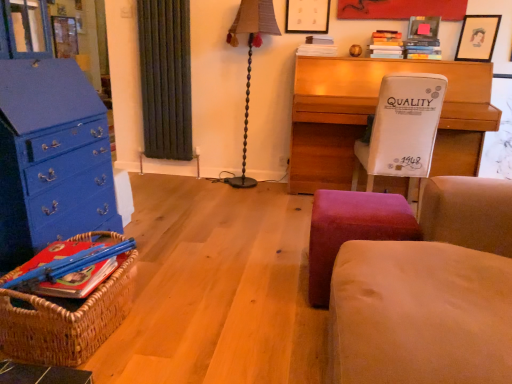
Measure the distance between wooden desk at center and camera.

The distance of wooden desk at center from camera is 9.23 feet.

At what (x,y) coordinates should I click in order to perform the action: click on blue painted wood chest of drawers at left. Please return your answer as a coordinate pair (x, y). Looking at the image, I should click on (51, 158).

Consider the image. In order to face beige fabric rocking chair at right, should I rotate leftwards or rightwards?

Rotate right and turn 26.851 degrees.

Find the location of a particular element. The image size is (512, 384). wooden desk at center is located at coordinates (373, 113).

Considering the positions of objects matte black picture frame at upper right, the third picture frame in the left-to-right sequence, and brown fabric lampshade at center in the image provided, who is in front, matte black picture frame at upper right, the third picture frame in the left-to-right sequence, or brown fabric lampshade at center?

Positioned in front is matte black picture frame at upper right, the third picture frame in the left-to-right sequence.

From a real-world perspective, is matte black picture frame at upper right, the first picture frame positioned from the right, physically located above or below brown fabric lampshade at center?

Clearly, from a real-world perspective, matte black picture frame at upper right, the first picture frame positioned from the right, is above brown fabric lampshade at center.

Can you confirm if matte black picture frame at upper right, the first picture frame positioned from the right, is bigger than brown fabric lampshade at center?

Actually, matte black picture frame at upper right, the first picture frame positioned from the right, might be smaller than brown fabric lampshade at center.

Is point (479, 32) closer to camera compared to point (227, 39)?

Yes, it is in front of point (227, 39).

Considering the sizes of brown fabric lampshade at center and velvet red stool at lower center in the image, is brown fabric lampshade at center taller or shorter than velvet red stool at lower center?

In the image, brown fabric lampshade at center appears to be taller than velvet red stool at lower center.

Considering the positions of objects brown fabric lampshade at center and velvet red stool at lower center in the image provided, who is more to the left, brown fabric lampshade at center or velvet red stool at lower center?

brown fabric lampshade at center.

From the image's perspective, which is below, brown fabric lampshade at center or velvet red stool at lower center?

velvet red stool at lower center, from the image's perspective.

Does point (269, 21) lie behind point (345, 204)?

Yes.

From a real-world perspective, between velvet red stool at lower center and brown fabric lampshade at center, who is vertically lower?

velvet red stool at lower center, from a real-world perspective.

Who is more distant, velvet red stool at lower center or brown fabric lampshade at center?

brown fabric lampshade at center is behind.

Which is more to the left, velvet red stool at lower center or brown fabric lampshade at center?

From the viewer's perspective, brown fabric lampshade at center appears more on the left side.

Is velvet red stool at lower center positioned with its back to brown fabric lampshade at center?

velvet red stool at lower center is not turned away from brown fabric lampshade at center.

Looking at this image, does woven brown basket at lower left turn towards wooden desk at center?

No, woven brown basket at lower left is not aimed at wooden desk at center.

Can you see woven brown basket at lower left touching wooden desk at center?

woven brown basket at lower left and wooden desk at center are not in contact.

Which is closer, (x=61, y=358) or (x=323, y=139)?

Point (x=61, y=358).

Is wooden desk at center located within matte black picture frame at upper center, which ranks as the first picture frame in left-to-right order?

No, wooden desk at center is not surrounded by matte black picture frame at upper center, which ranks as the first picture frame in left-to-right order.

Which is more distant, (306, 32) or (436, 159)?

The point (306, 32) is farther from the camera.

Image resolution: width=512 pixels, height=384 pixels. I want to click on desk on the right of the matte black picture frame at upper center, which ranks as the first picture frame in left-to-right order, so click(x=373, y=113).

Looking at this image, relative to wooden desk at center, is matte black picture frame at upper center, the 3th picture frame from the right, in front or behind?

matte black picture frame at upper center, the 3th picture frame from the right, is behind wooden desk at center.

Would you consider beige fabric rocking chair at right to be distant from blue painted wood chest of drawers at left?

Yes, beige fabric rocking chair at right and blue painted wood chest of drawers at left are quite far apart.

Considering the positions of objects beige fabric rocking chair at right and blue painted wood chest of drawers at left in the image provided, who is behind, beige fabric rocking chair at right or blue painted wood chest of drawers at left?

blue painted wood chest of drawers at left is behind.

Locate an element on the screen. the chest of drawers behind the beige fabric rocking chair at right is located at coordinates (51, 158).

Does point (418, 249) come farther from viewer compared to point (45, 170)?

No.

Can you confirm if beige fabric rocking chair at right is positioned to the right of brown fabric lampshade at center?

Yes.

Is point (483, 240) closer or farther from the camera than point (242, 24)?

Point (483, 240) is closer to the camera than point (242, 24).

Is beige fabric rocking chair at right looking in the opposite direction of brown fabric lampshade at center?

That's not correct — beige fabric rocking chair at right is not looking away from brown fabric lampshade at center.

Where is `picture frame that is the 1st one above the brown fabric lampshade at center (from a real-world perspective)`? picture frame that is the 1st one above the brown fabric lampshade at center (from a real-world perspective) is located at coordinates (477, 38).

This screenshot has width=512, height=384. I want to click on stool that appears below the brown fabric lampshade at center (from the image's perspective), so click(352, 230).

When comparing their distances from brown fabric lampshade at center, does matte black picture frame at upper right, the first picture frame positioned from the right, or matte black picture frame at upper right, acting as the 2th picture frame starting from the left, seem further?

Based on the image, matte black picture frame at upper right, the first picture frame positioned from the right, appears to be further to brown fabric lampshade at center.

Estimate the real-world distances between objects in this image. Which object is closer to brown fabric lampshade at center, beige fabric rocking chair at right or wooden desk at center?

Among the two, wooden desk at center is located nearer to brown fabric lampshade at center.

Looking at the image, which one is located closer to velvet red stool at lower center, matte black picture frame at upper right, the third picture frame in the left-to-right sequence, or brown fabric lampshade at center?

brown fabric lampshade at center is positioned closer to the anchor velvet red stool at lower center.

Which object lies further to the anchor point velvet red stool at lower center, blue painted wood chest of drawers at left or matte black picture frame at upper right, the third picture frame in the left-to-right sequence?

matte black picture frame at upper right, the third picture frame in the left-to-right sequence, is positioned further to the anchor velvet red stool at lower center.

Looking at the image, which one is located closer to velvet red stool at lower center, brown fabric lampshade at center or matte black picture frame at upper center, the 3th picture frame from the right?

brown fabric lampshade at center is closer to velvet red stool at lower center.

When comparing their distances from beige fabric rocking chair at right, does matte black picture frame at upper center, which ranks as the first picture frame in left-to-right order, or matte black picture frame at upper right, arranged as the second picture frame when viewed from the right, seem further?

matte black picture frame at upper center, which ranks as the first picture frame in left-to-right order.

When comparing their distances from matte black picture frame at upper right, acting as the 2th picture frame starting from the left, does blue painted wood chest of drawers at left or wooden desk at center seem further?

Based on the image, blue painted wood chest of drawers at left appears to be further to matte black picture frame at upper right, acting as the 2th picture frame starting from the left.

Looking at the image, which one is located closer to brown fabric lampshade at center, beige fabric rocking chair at right or blue painted wood chest of drawers at left?

blue painted wood chest of drawers at left is positioned closer to the anchor brown fabric lampshade at center.

The height and width of the screenshot is (384, 512). Identify the location of the chest of drawers positioned between woven brown basket at lower left and brown fabric lampshade at center from near to far. (51, 158).

The height and width of the screenshot is (384, 512). I want to click on picture frame between matte black picture frame at upper right, acting as the 2th picture frame starting from the left, and velvet red stool at lower center vertically, so click(x=477, y=38).

The width and height of the screenshot is (512, 384). I want to click on table lamp between velvet red stool at lower center and matte black picture frame at upper center, the 3th picture frame from the right, along the z-axis, so click(250, 60).

In order to click on basket between beige fabric rocking chair at right and wooden desk at center along the z-axis in this screenshot , I will do `click(66, 320)`.